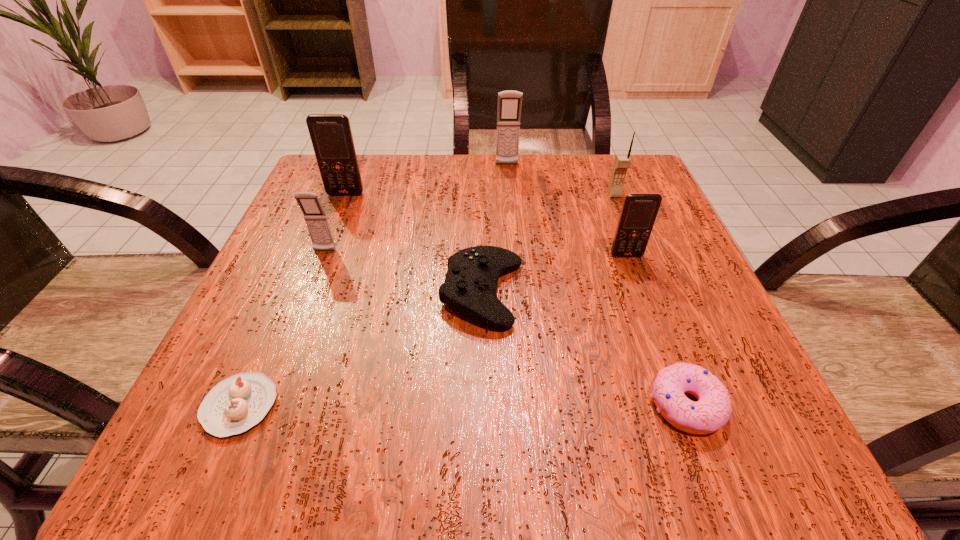
Where is `cupcake situated at the near edge`? cupcake situated at the near edge is located at coordinates (234, 405).

I want to click on cupcake that is at the left edge, so click(x=234, y=405).

What are the coordinates of `doughnut that is at the right edge` in the screenshot? It's located at (712, 411).

In order to click on object that is at the far left corner in this screenshot , I will do `click(331, 135)`.

You are a GUI agent. You are given a task and a screenshot of the screen. Output one action in this format:
    pyautogui.click(x=<x>, y=<y>)
    Task: Click on the object that is at the near left corner
    The width and height of the screenshot is (960, 540).
    Given the screenshot: What is the action you would take?
    pyautogui.click(x=234, y=405)

Find the location of a particular element. Image resolution: width=960 pixels, height=540 pixels. object that is at the far right corner is located at coordinates (622, 162).

The height and width of the screenshot is (540, 960). Find the location of `object that is at the near right corner`. object that is at the near right corner is located at coordinates (712, 411).

Where is `vacant region at the far edge`? Image resolution: width=960 pixels, height=540 pixels. vacant region at the far edge is located at coordinates (536, 200).

Image resolution: width=960 pixels, height=540 pixels. I want to click on vacant space at the near edge of the desktop, so click(x=377, y=465).

In the image, there is a desktop. At what (x,y) coordinates should I click in order to perform the action: click on vacant space at the left edge. Please return your answer as a coordinate pair (x, y). Looking at the image, I should click on (316, 286).